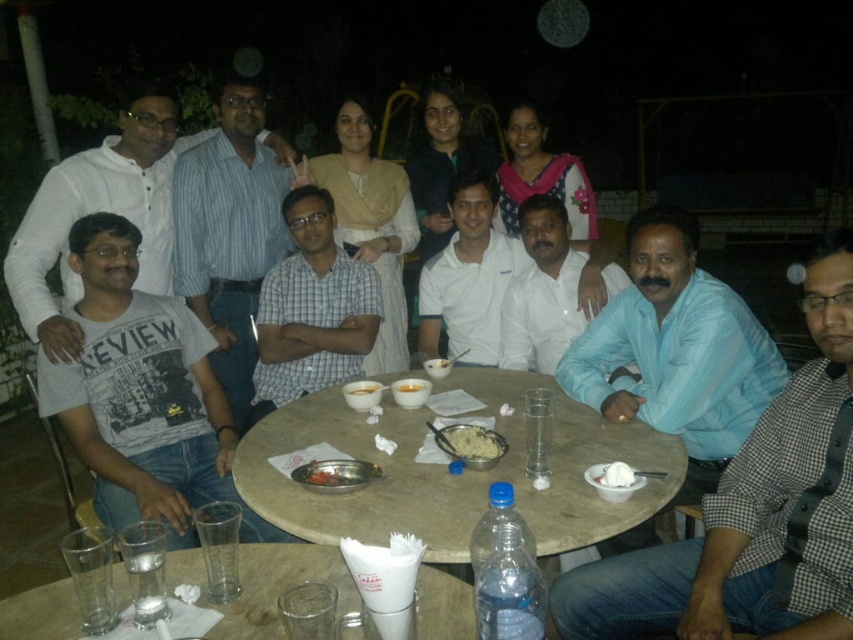
This screenshot has width=853, height=640. What do you see at coordinates (265, 584) in the screenshot? I see `clear plastic cups at lower center` at bounding box center [265, 584].

Between clear plastic cups at lower center and shiny metallic bowl at center, which one has less height?

With less height is shiny metallic bowl at center.

Where is `clear plastic cups at lower center`? The image size is (853, 640). clear plastic cups at lower center is located at coordinates (265, 584).

Which is more to the left, shiny metallic bowl at center or smooth white bowl at center?

Positioned to the left is shiny metallic bowl at center.

The width and height of the screenshot is (853, 640). In order to click on shiny metallic bowl at center in this screenshot , I will do `click(328, 476)`.

This screenshot has width=853, height=640. I want to click on shiny metallic bowl at center, so click(x=328, y=476).

Describe the element at coordinates (469, 442) in the screenshot. The image size is (853, 640). I see `white rice at center` at that location.

Consider the image. Measure the distance between point (x=471, y=436) and camera.

The distance of point (x=471, y=436) from camera is 6.33 feet.

Which is behind, point (460, 448) or point (601, 481)?

The point (460, 448) is behind.

The width and height of the screenshot is (853, 640). I want to click on white rice at center, so click(469, 442).